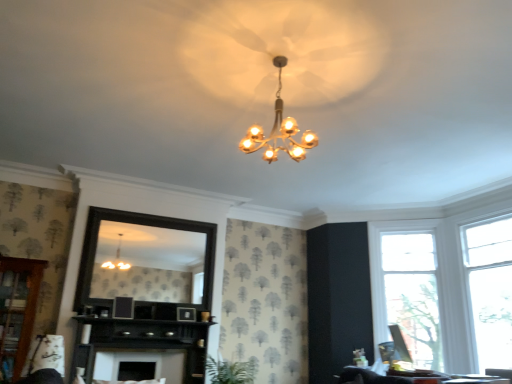
Question: Does gold metallic chandelier at upper center have a lesser width compared to clear glass window at right, positioned as the 2th window in left-to-right order?

Choices:
 (A) yes
 (B) no

Answer: (B)

Question: Is gold metallic chandelier at upper center further to the viewer compared to clear glass window at right, positioned as the 2th window in left-to-right order?

Choices:
 (A) yes
 (B) no

Answer: (B)

Question: Can you confirm if gold metallic chandelier at upper center is bigger than clear glass window at right, marked as the 1th window in a right-to-left arrangement?

Choices:
 (A) yes
 (B) no

Answer: (B)

Question: Can you confirm if gold metallic chandelier at upper center is wider than clear glass window at right, marked as the 1th window in a right-to-left arrangement?

Choices:
 (A) no
 (B) yes

Answer: (B)

Question: From the image's perspective, is gold metallic chandelier at upper center on clear glass window at right, positioned as the 2th window in left-to-right order?

Choices:
 (A) no
 (B) yes

Answer: (B)

Question: Does gold metallic chandelier at upper center appear on the right side of clear glass window at right, marked as the 1th window in a right-to-left arrangement?

Choices:
 (A) yes
 (B) no

Answer: (B)

Question: Is gold metallic chandelier at upper center beside white matte fireplace at lower center?

Choices:
 (A) yes
 (B) no

Answer: (B)

Question: Is gold metallic chandelier at upper center oriented towards white matte fireplace at lower center?

Choices:
 (A) yes
 (B) no

Answer: (B)

Question: Is gold metallic chandelier at upper center outside white matte fireplace at lower center?

Choices:
 (A) yes
 (B) no

Answer: (A)

Question: From the image's perspective, is gold metallic chandelier at upper center under white matte fireplace at lower center?

Choices:
 (A) yes
 (B) no

Answer: (B)

Question: From the image's perspective, is gold metallic chandelier at upper center over white matte fireplace at lower center?

Choices:
 (A) yes
 (B) no

Answer: (A)

Question: Is the position of gold metallic chandelier at upper center more distant than that of white matte fireplace at lower center?

Choices:
 (A) yes
 (B) no

Answer: (B)

Question: From a real-world perspective, is black wooden mirror at center beneath clear glass window at right, placed as the 2th window when sorted from right to left?

Choices:
 (A) yes
 (B) no

Answer: (B)